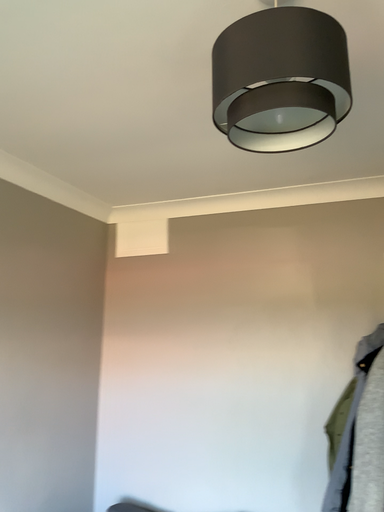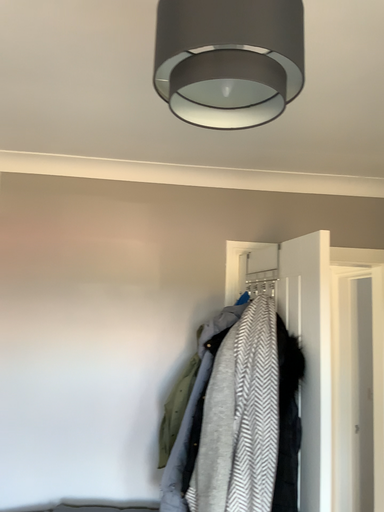
Question: How did the camera likely rotate when shooting the video?

Choices:
 (A) rotated left
 (B) rotated right

Answer: (B)